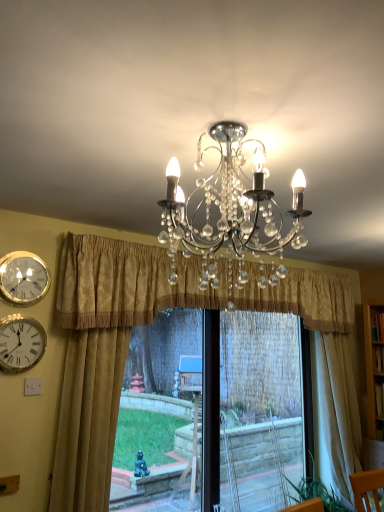
Question: Is white glossy wall clock at left, which is counted as the 2th wall clock, starting from the top, smaller than gold textured curtain at center, which is the 2th curtain from left to right?

Choices:
 (A) no
 (B) yes

Answer: (B)

Question: From a real-world perspective, is white glossy wall clock at left, which is counted as the 2th wall clock, starting from the top, positioned over gold textured curtain at center, which ranks as the 2th curtain in right-to-left order, based on gravity?

Choices:
 (A) no
 (B) yes

Answer: (A)

Question: Does white glossy wall clock at left, which is counted as the 2th wall clock, starting from the top, have a lesser height compared to gold textured curtain at center, which ranks as the 2th curtain in right-to-left order?

Choices:
 (A) yes
 (B) no

Answer: (A)

Question: Is white glossy wall clock at left, which is counted as the 2th wall clock, starting from the top, bigger than gold textured curtain at center, which ranks as the 2th curtain in right-to-left order?

Choices:
 (A) no
 (B) yes

Answer: (A)

Question: Is white glossy wall clock at left, the first wall clock positioned from the bottom, at the right side of gold textured curtain at center, which ranks as the 2th curtain in right-to-left order?

Choices:
 (A) yes
 (B) no

Answer: (B)

Question: Is white glossy wall clock at left, which is counted as the 2th wall clock, starting from the top, surrounding gold textured curtain at center, which ranks as the 2th curtain in right-to-left order?

Choices:
 (A) no
 (B) yes

Answer: (A)

Question: From a real-world perspective, does black plastic window frame at center sit lower than gold textured curtain at center, which is the 2th curtain from left to right?

Choices:
 (A) yes
 (B) no

Answer: (A)

Question: Is black plastic window frame at center to the right of gold textured curtain at center, which ranks as the 2th curtain in right-to-left order, from the viewer's perspective?

Choices:
 (A) no
 (B) yes

Answer: (B)

Question: Considering the relative positions of black plastic window frame at center and gold textured curtain at center, which is the 2th curtain from left to right, in the image provided, is black plastic window frame at center in front of gold textured curtain at center, which is the 2th curtain from left to right,?

Choices:
 (A) no
 (B) yes

Answer: (A)

Question: From the image's perspective, is black plastic window frame at center above gold textured curtain at center, which ranks as the 2th curtain in right-to-left order?

Choices:
 (A) yes
 (B) no

Answer: (B)

Question: Are black plastic window frame at center and gold textured curtain at center, which ranks as the 2th curtain in right-to-left order, located far from each other?

Choices:
 (A) no
 (B) yes

Answer: (B)

Question: From a real-world perspective, is black plastic window frame at center physically above gold textured curtain at center, which is the 2th curtain from left to right?

Choices:
 (A) no
 (B) yes

Answer: (A)

Question: Would you consider gold textured curtain at center, which is the 2th curtain from left to right, to be distant from white glossy wall clock at left, which is counted as the 2th wall clock, starting from the top?

Choices:
 (A) no
 (B) yes

Answer: (A)